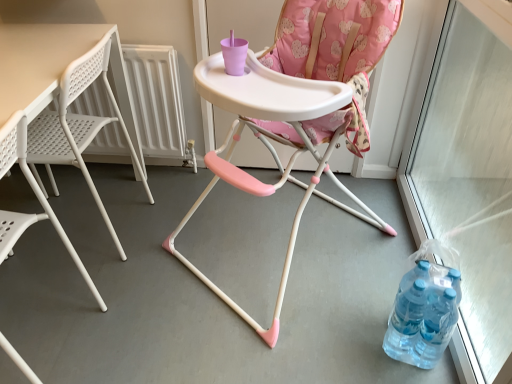
The height and width of the screenshot is (384, 512). Find the location of `free area below white plastic chair at left, the second chair when ordered from right to left (from a real-world perspective)`. free area below white plastic chair at left, the second chair when ordered from right to left (from a real-world perspective) is located at coordinates (45, 337).